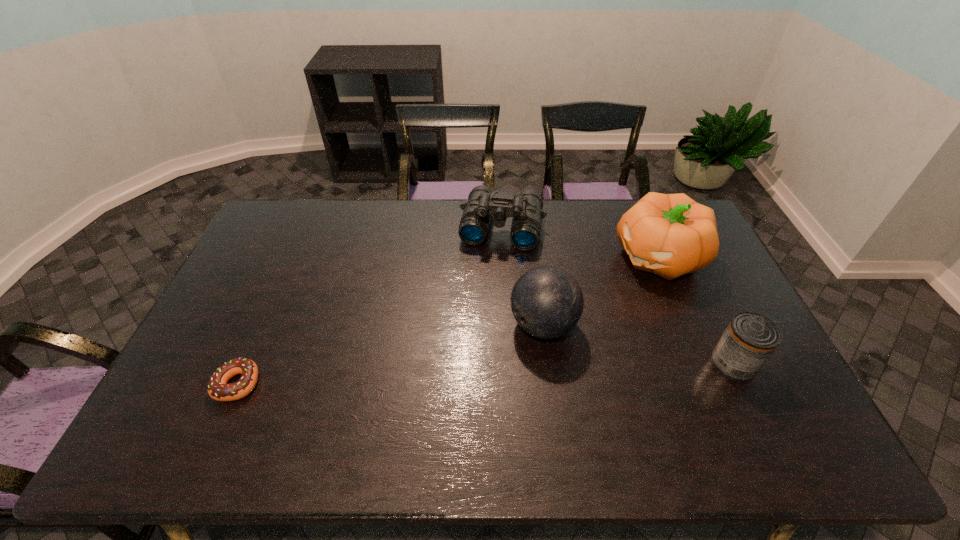
Find the location of a particular element. vacant space that is in between the pumpkin and the can is located at coordinates (697, 310).

The height and width of the screenshot is (540, 960). What are the coordinates of `free point between the shortest object and the pumpkin` in the screenshot? It's located at (449, 321).

Locate an element on the screen. This screenshot has width=960, height=540. vacant point located between the binoculars and the can is located at coordinates (617, 296).

Identify the location of vacant space in between the can and the pumpkin. (697, 310).

You are a GUI agent. You are given a task and a screenshot of the screen. Output one action in this format:
    pyautogui.click(x=<x>, y=<y>)
    Task: Click on the vacant point located between the pumpkin and the second tallest object
    The width and height of the screenshot is (960, 540).
    Given the screenshot: What is the action you would take?
    pyautogui.click(x=602, y=292)

Where is `unoccupied area between the fourth shortest object and the leftmost object`? unoccupied area between the fourth shortest object and the leftmost object is located at coordinates (391, 354).

Where is `free space between the shortest object and the pumpkin`? The image size is (960, 540). free space between the shortest object and the pumpkin is located at coordinates (449, 321).

In order to click on vacant region between the leftmost object and the binoculars in this screenshot , I will do `click(370, 306)`.

Image resolution: width=960 pixels, height=540 pixels. I want to click on free space between the pumpkin and the leftmost object, so click(449, 321).

Select which object is the closest to the second tallest object. Please provide its 2D coordinates. Your answer should be formatted as a tuple, i.e. [(x, y)], where the tuple contains the x and y coordinates of a point satisfying the conditions above.

[(670, 235)]